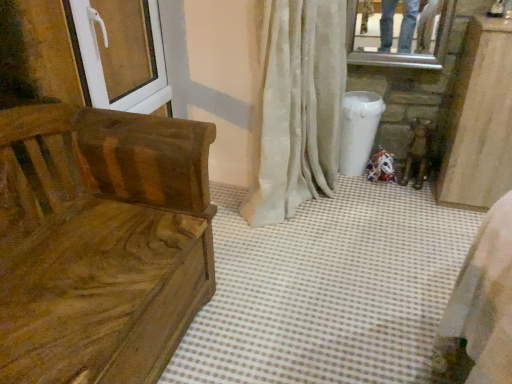
The image size is (512, 384). Identify the location of wooden bench at left. (100, 242).

This screenshot has height=384, width=512. What do you see at coordinates (298, 109) in the screenshot?
I see `white textured curtain at center` at bounding box center [298, 109].

Identify the location of white plastic screen door at upper left. This screenshot has width=512, height=384. pos(122,54).

Does wooden bench at left appear on the right side of white plastic screen door at upper left?

No, wooden bench at left is not to the right of white plastic screen door at upper left.

Is point (111, 319) behind point (159, 30)?

No, (111, 319) is in front of (159, 30).

From the image's perspective, is wooden bench at left located above or below white plastic screen door at upper left?

From the image's perspective, wooden bench at left appears below white plastic screen door at upper left.

There is a wooden bench at left. Where is `screen door above it (from a real-world perspective)`? screen door above it (from a real-world perspective) is located at coordinates (122, 54).

Considering the sizes of wooden bench at left and white textured curtain at center in the image, is wooden bench at left wider or thinner than white textured curtain at center?

wooden bench at left is wider than white textured curtain at center.

From the image's perspective, which one is positioned higher, wooden bench at left or white textured curtain at center?

white textured curtain at center, from the image's perspective.

Is wooden bench at left placed right next to white textured curtain at center?

wooden bench at left and white textured curtain at center are not in contact.

From a real-world perspective, which object rests below the other?

wooden bench at left, from a real-world perspective.

Based on their sizes in the image, would you say white textured curtain at center is bigger or smaller than white plastic screen door at upper left?

white textured curtain at center is bigger than white plastic screen door at upper left.

Which of these two, white textured curtain at center or white plastic screen door at upper left, is thinner?

With smaller width is white plastic screen door at upper left.

From a real-world perspective, between white textured curtain at center and white plastic screen door at upper left, who is vertically lower?

white textured curtain at center.

Is point (310, 112) positioned after point (149, 58)?

No.

Is white textured curtain at center facing towards wooden bench at left?

No, white textured curtain at center is not turned towards wooden bench at left.

Where is `furniture below the white textured curtain at center (from a real-world perspective)`? Image resolution: width=512 pixels, height=384 pixels. furniture below the white textured curtain at center (from a real-world perspective) is located at coordinates (100, 242).

Is white textured curtain at center to the right of wooden bench at left from the viewer's perspective?

Yes.

From the picture: From the image's perspective, which one is positioned higher, white textured curtain at center or wooden bench at left?

white textured curtain at center appears higher in the image.

Based on the photo, does white plastic screen door at upper left appear on the right side of white textured curtain at center?

No.

Looking at this image, who is shorter, white plastic screen door at upper left or white textured curtain at center?

white plastic screen door at upper left.

Considering the sizes of objects white plastic screen door at upper left and white textured curtain at center in the image provided, who is thinner, white plastic screen door at upper left or white textured curtain at center?

Thinner between the two is white plastic screen door at upper left.

Which is correct: white plastic screen door at upper left is inside wooden bench at left, or outside of it?

white plastic screen door at upper left is spatially situated outside wooden bench at left.

I want to click on furniture in front of the white plastic screen door at upper left, so click(x=100, y=242).

Does white plastic screen door at upper left appear on the left side of wooden bench at left?

No, white plastic screen door at upper left is not to the left of wooden bench at left.

Locate an element on the screen. Image resolution: width=512 pixels, height=384 pixels. furniture below the white plastic screen door at upper left (from a real-world perspective) is located at coordinates (100, 242).

Identify the location of curtain behind the wooden bench at left. The height and width of the screenshot is (384, 512). (298, 109).

In the scene shown: Considering their positions, is wooden bench at left positioned further to white plastic screen door at upper left than white textured curtain at center?

white textured curtain at center is further to white plastic screen door at upper left.

Considering their positions, is white textured curtain at center positioned closer to white plastic screen door at upper left than wooden bench at left?

wooden bench at left lies closer to white plastic screen door at upper left than the other object.

When comparing their distances from white textured curtain at center, does wooden bench at left or white plastic screen door at upper left seem closer?

white plastic screen door at upper left.

Considering their positions, is white plastic screen door at upper left positioned closer to white textured curtain at center than wooden bench at left?

Among the two, white plastic screen door at upper left is located nearer to white textured curtain at center.

Looking at the image, which one is located closer to wooden bench at left, white textured curtain at center or white plastic screen door at upper left?

Among the two, white plastic screen door at upper left is located nearer to wooden bench at left.

When comparing their distances from wooden bench at left, does white plastic screen door at upper left or white textured curtain at center seem further?

The object further to wooden bench at left is white textured curtain at center.

Image resolution: width=512 pixels, height=384 pixels. Identify the location of curtain between wooden bench at left and white plastic screen door at upper left in the front-back direction. (298, 109).